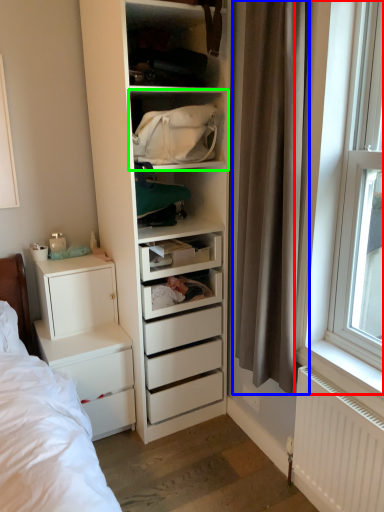
Question: Which object is positioned closest to window (highlighted by a red box)? Select from curtain (highlighted by a blue box) and shelf (highlighted by a green box).

Choices:
 (A) curtain
 (B) shelf

Answer: (A)